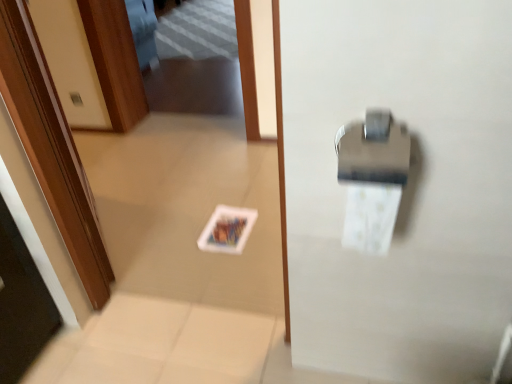
What are the coordinates of `vacant space behind wooden screen door at left` in the screenshot? It's located at (131, 196).